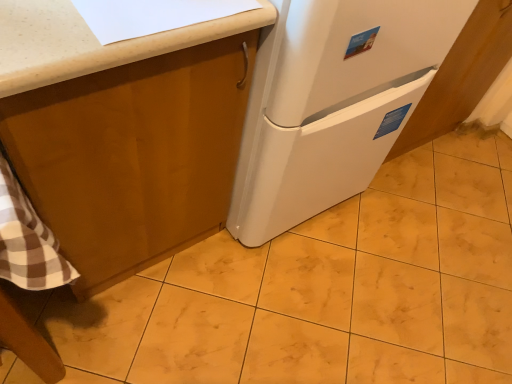
Where is `free location to the right of white glossy cabinet at lower right, arranged as the second cabinetry when viewed from the left`? free location to the right of white glossy cabinet at lower right, arranged as the second cabinetry when viewed from the left is located at coordinates (472, 169).